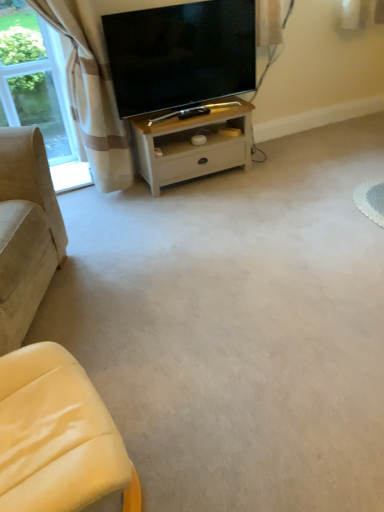
The width and height of the screenshot is (384, 512). What are the coordinates of `free space on the front side of white wood table at center` in the screenshot? It's located at (200, 210).